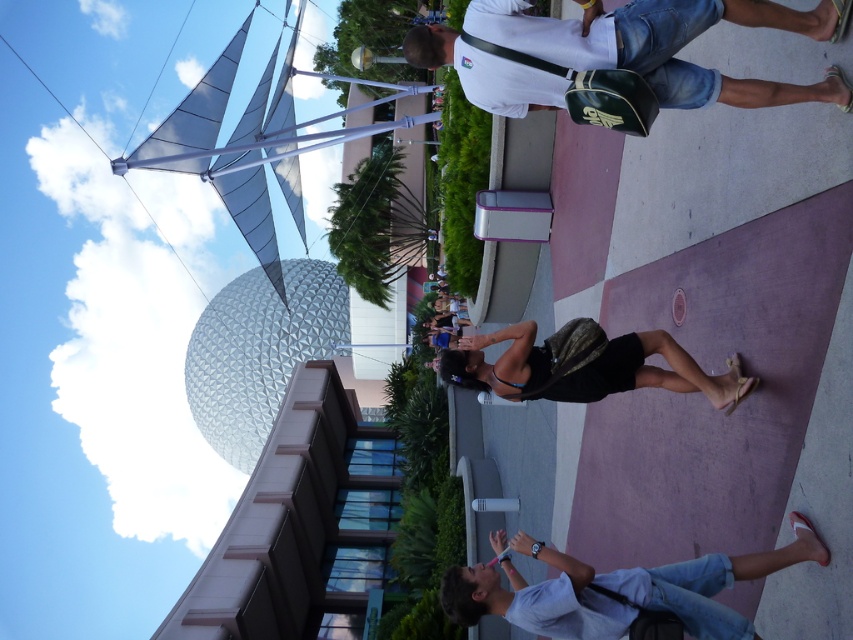
Does white cotton shirt at lower right have a greater height compared to black fabric bag at center?

Yes.

Can you confirm if white cotton shirt at lower right is positioned below black fabric bag at center?

Correct, white cotton shirt at lower right is located below black fabric bag at center.

Describe the element at coordinates (618, 589) in the screenshot. I see `white cotton shirt at lower right` at that location.

Find the location of a particular element. The height and width of the screenshot is (640, 853). white cotton shirt at lower right is located at coordinates (618, 589).

Is point (683, 20) closer to viewer compared to point (515, 577)?

Yes, point (683, 20) is in front of point (515, 577).

Does white matte shirt at upper center lie behind white cotton shirt at lower right?

No, it is in front of white cotton shirt at lower right.

Does point (494, 106) lie in front of point (531, 589)?

No.

Identify the location of white matte shirt at upper center. (660, 44).

Measure the distance from white matte shirt at upper center to black fabric bag at center.

white matte shirt at upper center is 12.21 meters from black fabric bag at center.

Between white matte shirt at upper center and black fabric bag at center, which one is positioned lower?

black fabric bag at center is lower down.

Where is `white matte shirt at upper center`? Image resolution: width=853 pixels, height=640 pixels. white matte shirt at upper center is located at coordinates (660, 44).